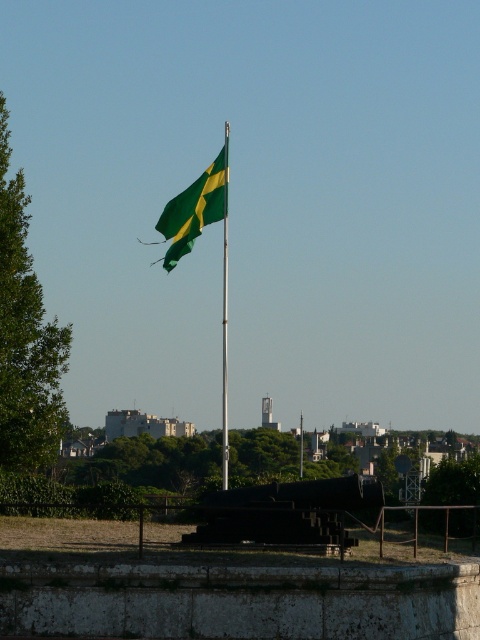
Question: From the image, what is the correct spatial relationship of green matte flag at center in relation to silver metallic pole at center?

Choices:
 (A) left
 (B) right

Answer: (A)

Question: Which point is farther from the camera taking this photo?

Choices:
 (A) (196, 205)
 (B) (301, 419)

Answer: (B)

Question: Among these points, which one is farthest from the camera?

Choices:
 (A) (301, 433)
 (B) (179, 237)

Answer: (A)

Question: Can you confirm if green matte flag at center is positioned to the right of silver metallic pole at center?

Choices:
 (A) yes
 (B) no

Answer: (B)

Question: Can you confirm if green matte flag at center is wider than silver metallic pole at center?

Choices:
 (A) no
 (B) yes

Answer: (B)